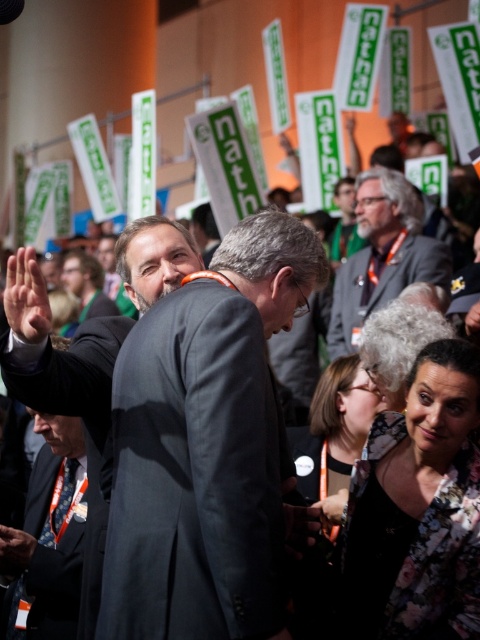
Question: Based on their relative distances, which object is farther from the dark gray suit at lower left?

Choices:
 (A) gray hair at center
 (B) dark gray suit at center

Answer: (A)

Question: Considering the real-world distances, which object is closest to the dark gray suit at center?

Choices:
 (A) gray hair at center
 (B) dark gray suit at lower left

Answer: (B)

Question: Does dark gray suit at center appear on the right side of dark gray suit at lower left?

Choices:
 (A) no
 (B) yes

Answer: (B)

Question: Which is nearer to the dark gray suit at center?

Choices:
 (A) gray hair at center
 (B) dark gray suit at lower left

Answer: (B)

Question: Observing the image, what is the correct spatial positioning of dark gray suit at center in reference to gray hair at center?

Choices:
 (A) left
 (B) right

Answer: (A)

Question: Is dark gray suit at center below gray hair at center?

Choices:
 (A) no
 (B) yes

Answer: (B)